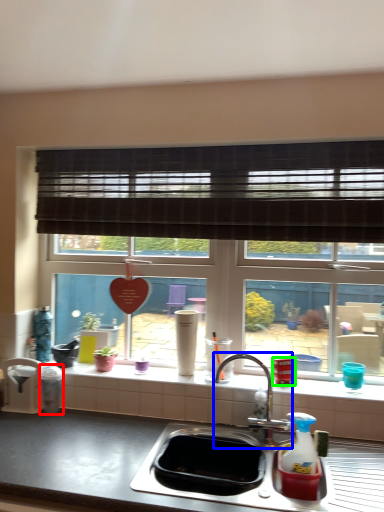
Question: Which object is the farthest from appliance (highlighted by a red box)? Choose among these: tap (highlighted by a blue box) or appliance (highlighted by a green box).

Choices:
 (A) tap
 (B) appliance

Answer: (B)